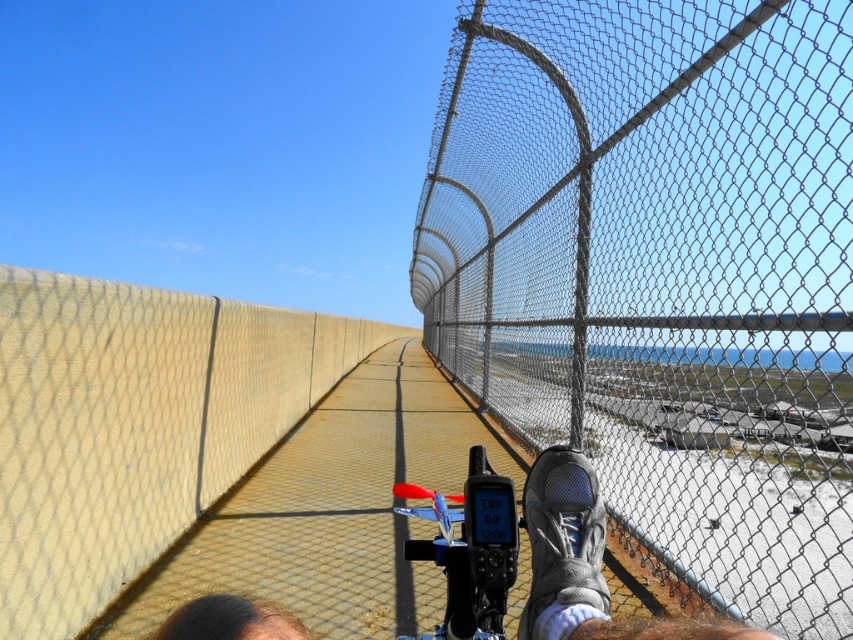
Question: Among these points, which one is nearest to the camera?

Choices:
 (A) (569, 532)
 (B) (120, 577)

Answer: (A)

Question: Among these objects, which one is farthest from the camera?

Choices:
 (A) gray fabric shoe at lower center
 (B) gray mesh shoe at center
 (C) yellow concrete wall at center
 (D) metal mesh fence at right

Answer: (D)

Question: Does metal mesh fence at right come behind gray fabric shoe at lower center?

Choices:
 (A) yes
 (B) no

Answer: (A)

Question: Does yellow concrete wall at center have a lesser width compared to gray mesh shoe at center?

Choices:
 (A) no
 (B) yes

Answer: (A)

Question: Which object is positioned farthest from the metal mesh fence at right?

Choices:
 (A) gray fabric shoe at lower center
 (B) yellow concrete wall at center
 (C) gray mesh shoe at center

Answer: (B)

Question: Is metal mesh fence at right wider than yellow concrete wall at center?

Choices:
 (A) yes
 (B) no

Answer: (A)